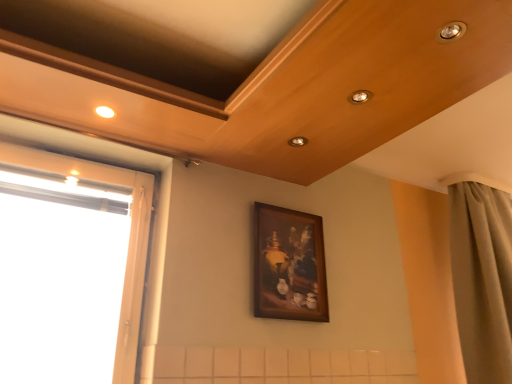
Question: Is wooden framed painting at center aimed at transparent glass window at left?

Choices:
 (A) yes
 (B) no

Answer: (B)

Question: Is wooden framed painting at center behind transparent glass window at left?

Choices:
 (A) no
 (B) yes

Answer: (B)

Question: Is wooden framed painting at center at the left side of transparent glass window at left?

Choices:
 (A) no
 (B) yes

Answer: (A)

Question: From a real-world perspective, is wooden framed painting at center beneath transparent glass window at left?

Choices:
 (A) yes
 (B) no

Answer: (B)

Question: Would you say transparent glass window at left is part of wooden framed painting at center's contents?

Choices:
 (A) no
 (B) yes

Answer: (A)

Question: From a real-world perspective, relative to matte beige curtain at right, is transparent glass window at left vertically above or below?

Choices:
 (A) above
 (B) below

Answer: (B)

Question: Is transparent glass window at left situated inside matte beige curtain at right or outside?

Choices:
 (A) outside
 (B) inside

Answer: (A)

Question: In terms of height, does transparent glass window at left look taller or shorter compared to matte beige curtain at right?

Choices:
 (A) short
 (B) tall

Answer: (A)

Question: Is transparent glass window at left bigger or smaller than matte beige curtain at right?

Choices:
 (A) small
 (B) big

Answer: (A)

Question: Considering the positions of wooden framed painting at center and matte beige curtain at right in the image, is wooden framed painting at center bigger or smaller than matte beige curtain at right?

Choices:
 (A) big
 (B) small

Answer: (B)

Question: From the image's perspective, is wooden framed painting at center positioned above or below matte beige curtain at right?

Choices:
 (A) below
 (B) above

Answer: (B)

Question: In the image, is wooden framed painting at center positioned in front of or behind matte beige curtain at right?

Choices:
 (A) front
 (B) behind

Answer: (A)

Question: Would you say wooden framed painting at center is inside or outside matte beige curtain at right?

Choices:
 (A) inside
 (B) outside

Answer: (B)

Question: Is point (492, 299) closer or farther from the camera than point (310, 268)?

Choices:
 (A) closer
 (B) farther

Answer: (B)

Question: Is matte beige curtain at right taller or shorter than wooden framed painting at center?

Choices:
 (A) short
 (B) tall

Answer: (B)